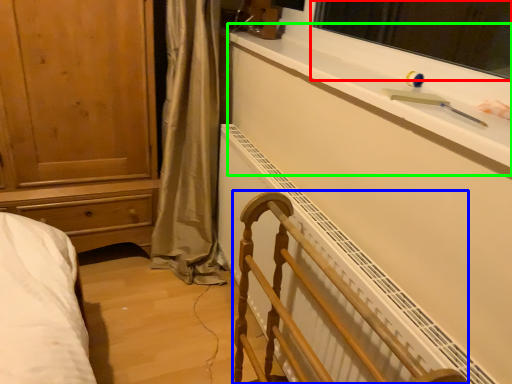
Question: Which is farther away from window screen (highlighted by a red box)? furniture (highlighted by a blue box) or window sill (highlighted by a green box)?

Choices:
 (A) furniture
 (B) window sill

Answer: (A)